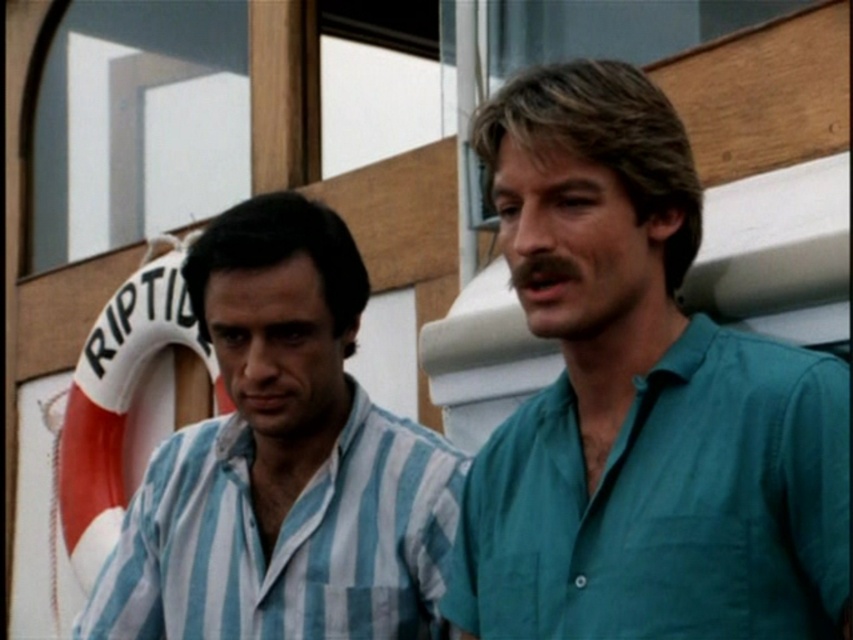
You are a photographer trying to capture a candid shot of both the teal cotton shirt at right and the blue striped shirt at left. Since you want to ensure both shirts are visible in the frame, can you determine which shirt you should focus on first based on their positions?

The teal cotton shirt at right is above the blue striped shirt at left, so you should focus on the teal cotton shirt at right first to ensure both are in the frame.

You are a tailor measuring shirts for alterations. You have a customer who wants to know if their teal cotton shirt at right can be adjusted to fit the same size as the blue striped shirt at left. Based on the image, what should you inform them?

The teal cotton shirt at right is wider than the blue striped shirt at left, so it cannot be adjusted to match the exact width unless the customer is willing to have it tailored to a narrower fit.